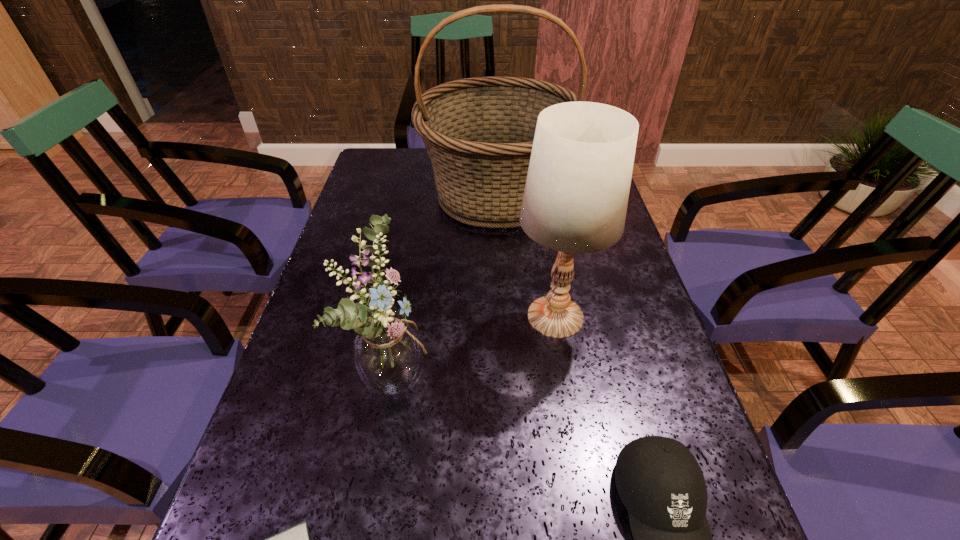
What are the coordinates of `object that is at the far right corner` in the screenshot? It's located at point(479,132).

Identify the location of free space at the left edge. The height and width of the screenshot is (540, 960). (327, 410).

In the image, there is a desktop. Find the location of `free space at the right edge`. free space at the right edge is located at coordinates (642, 277).

The height and width of the screenshot is (540, 960). Identify the location of vacant area at the far left corner. (411, 152).

Find the location of `vacant space that is in between the bouquet and the lamp`. vacant space that is in between the bouquet and the lamp is located at coordinates (475, 344).

Find the location of a particular element. Image resolution: width=960 pixels, height=540 pixels. vacant point located between the basket and the lamp is located at coordinates (526, 256).

Where is `vacant area that lies between the basket and the lamp`? The image size is (960, 540). vacant area that lies between the basket and the lamp is located at coordinates (526, 256).

The height and width of the screenshot is (540, 960). I want to click on unoccupied position between the basket and the lamp, so click(526, 256).

Locate an element on the screen. free space between the lamp and the third tallest object is located at coordinates (475, 344).

Select which object appears as the third closest to the second shortest object. Please provide its 2D coordinates. Your answer should be formatted as a tuple, i.e. [(x, y)], where the tuple contains the x and y coordinates of a point satisfying the conditions above.

[(295, 539)]